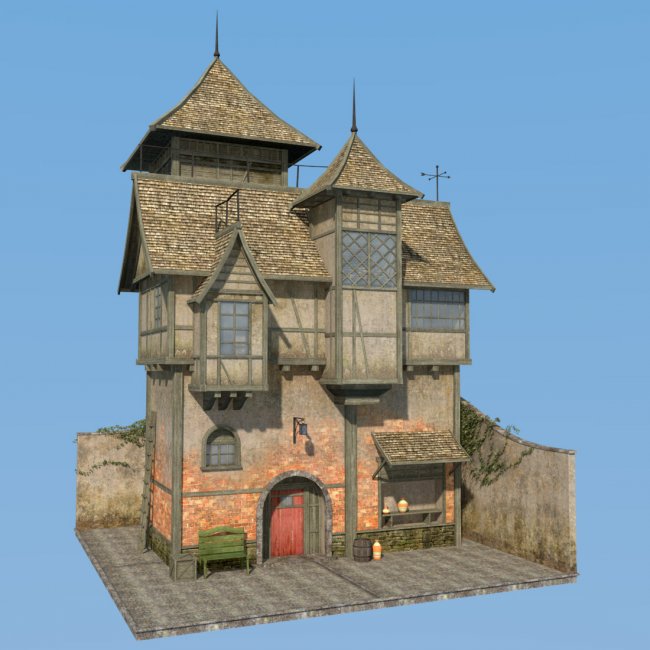
Locate an element on the screen. This screenshot has width=650, height=650. door is located at coordinates (290, 525).